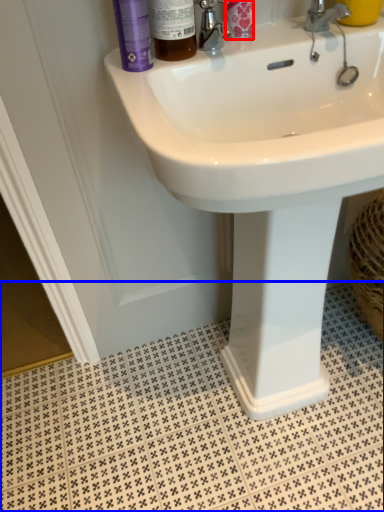
Question: Which of the following is the closest to the observer, toiletry (highlighted by a red box) or tile (highlighted by a blue box)?

Choices:
 (A) toiletry
 (B) tile

Answer: (A)